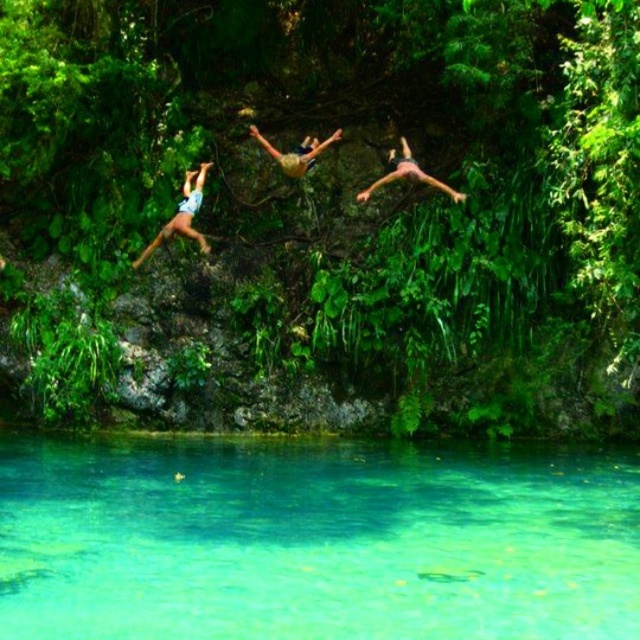
Question: Is transparent water at lower center to the right of camouflage shorts at center from the viewer's perspective?

Choices:
 (A) no
 (B) yes

Answer: (B)

Question: Does pink matte skin at center appear over camouflage shorts at center?

Choices:
 (A) no
 (B) yes

Answer: (A)

Question: Which object is farther from the camera taking this photo?

Choices:
 (A) light blue denim shorts at left
 (B) pink matte skin at center

Answer: (B)

Question: Estimate the real-world distances between objects in this image. Which object is closer to the pink matte skin at center?

Choices:
 (A) transparent water at lower center
 (B) light blue denim shorts at left

Answer: (B)

Question: Is pink matte skin at center behind camouflage shorts at center?

Choices:
 (A) no
 (B) yes

Answer: (A)

Question: Which object appears farthest from the camera in this image?

Choices:
 (A) pink matte skin at center
 (B) light blue denim shorts at left
 (C) transparent water at lower center

Answer: (A)